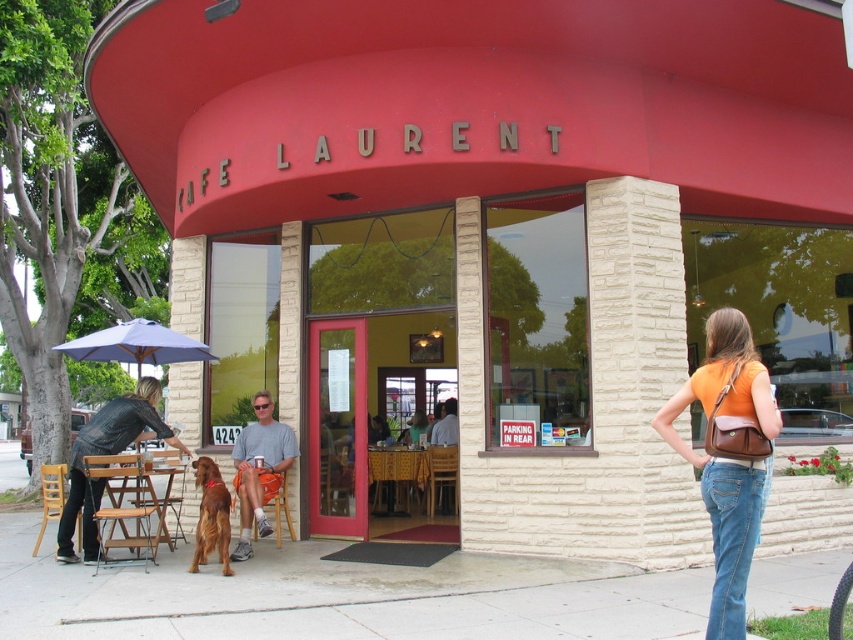
Question: Which of these objects is positioned farthest from the orange leather purse at right?

Choices:
 (A) gray fabric shorts at lower left
 (B) denim jacket at lower left
 (C) shiny brown dog at lower left

Answer: (B)

Question: Estimate the real-world distances between objects in this image. Which object is closer to the denim jacket at lower left?

Choices:
 (A) gray fabric shorts at lower left
 (B) shiny brown dog at lower left
 (C) matte purple umbrella at left
 (D) orange leather purse at right

Answer: (B)

Question: Does orange leather purse at right appear on the right side of shiny brown dog at lower left?

Choices:
 (A) yes
 (B) no

Answer: (A)

Question: Which object appears closest to the camera in this image?

Choices:
 (A) shiny brown dog at lower left
 (B) orange leather purse at right

Answer: (B)

Question: Is orange leather purse at right in front of denim jacket at lower left?

Choices:
 (A) no
 (B) yes

Answer: (B)

Question: In this image, where is denim jacket at lower left located relative to matte purple umbrella at left?

Choices:
 (A) left
 (B) right

Answer: (B)